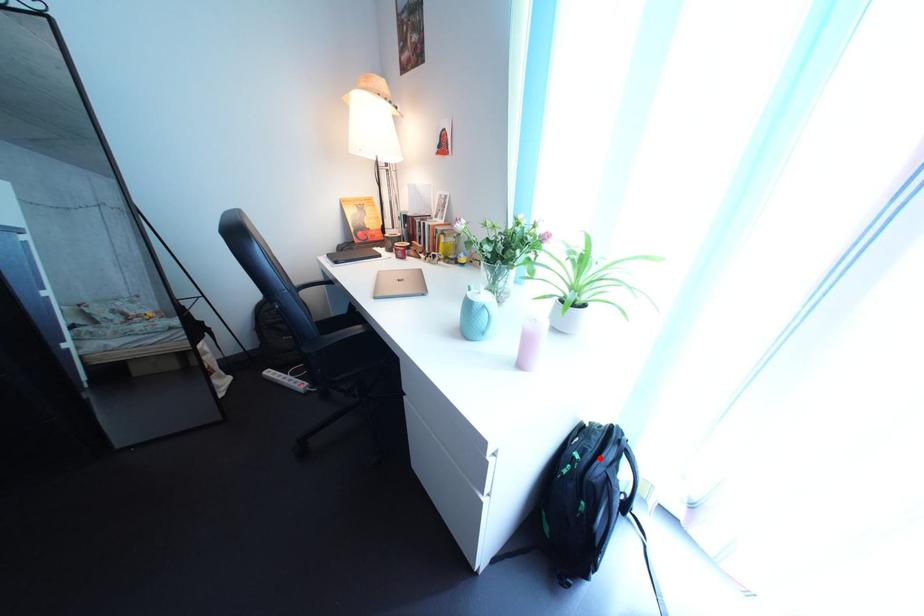
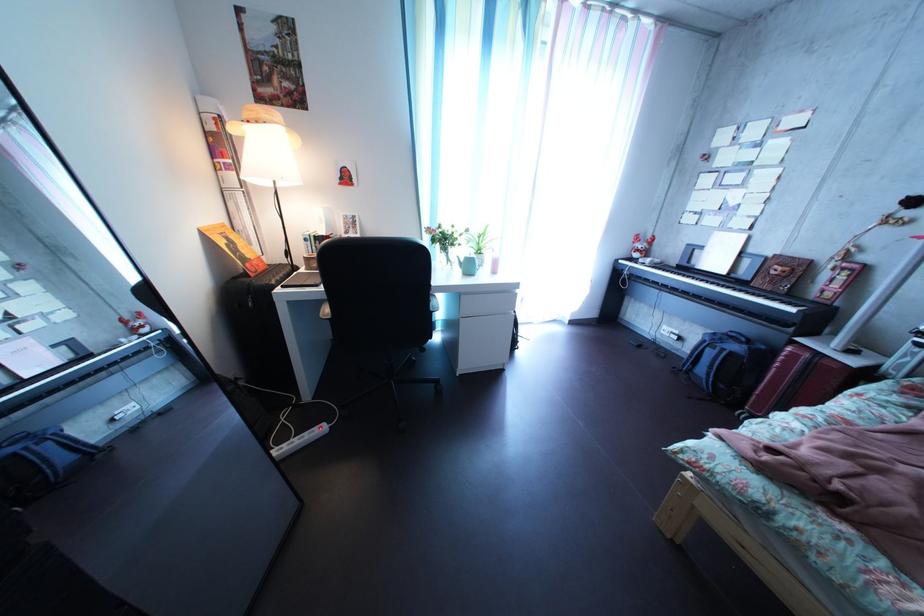
Question: I am providing you with two images of the same scene from different viewpoints. A red point is marked on the first image. Can you still see the location of the red point in image 2?

Choices:
 (A) Yes
 (B) No

Answer: (B)